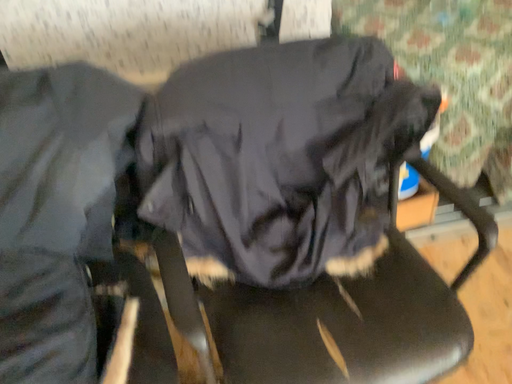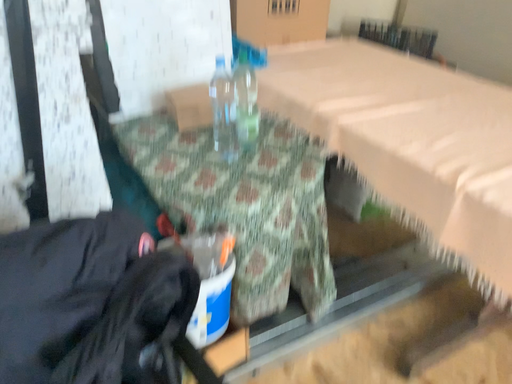
Question: Which way did the camera rotate in the video?

Choices:
 (A) rotated left
 (B) rotated right

Answer: (B)